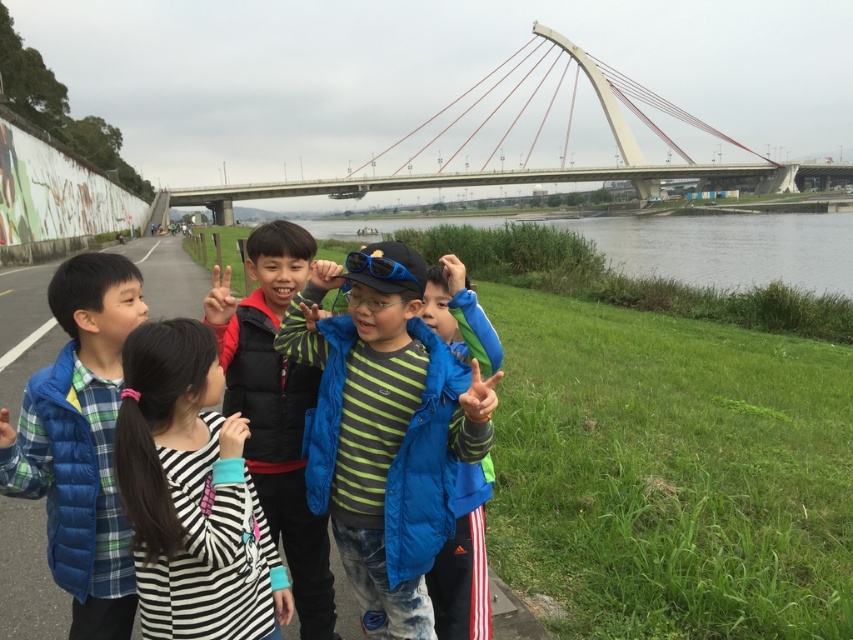
Question: From the image, what is the correct spatial relationship of white concrete bridge at upper center in relation to green grass at lower right?

Choices:
 (A) below
 (B) above

Answer: (B)

Question: Among these objects, which one is farthest from the camera?

Choices:
 (A) striped fabric dress at center
 (B) green striped shirt at center
 (C) blue fleece jacket at center

Answer: (C)

Question: Does striped fabric dress at center have a larger size compared to blue down jacket at left?

Choices:
 (A) no
 (B) yes

Answer: (A)

Question: Considering the relative positions of green striped shirt at center and matte black vest at center in the image provided, where is green striped shirt at center located with respect to matte black vest at center?

Choices:
 (A) above
 (B) below

Answer: (B)

Question: Which point is closer to the camera?

Choices:
 (A) striped fabric dress at center
 (B) green grass at lower right
 (C) blue fleece jacket at center
 (D) matte black vest at center

Answer: (A)

Question: Among these objects, which one is farthest from the camera?

Choices:
 (A) blue down jacket at left
 (B) striped fabric dress at center
 (C) blue fleece jacket at center
 (D) green striped shirt at center

Answer: (C)